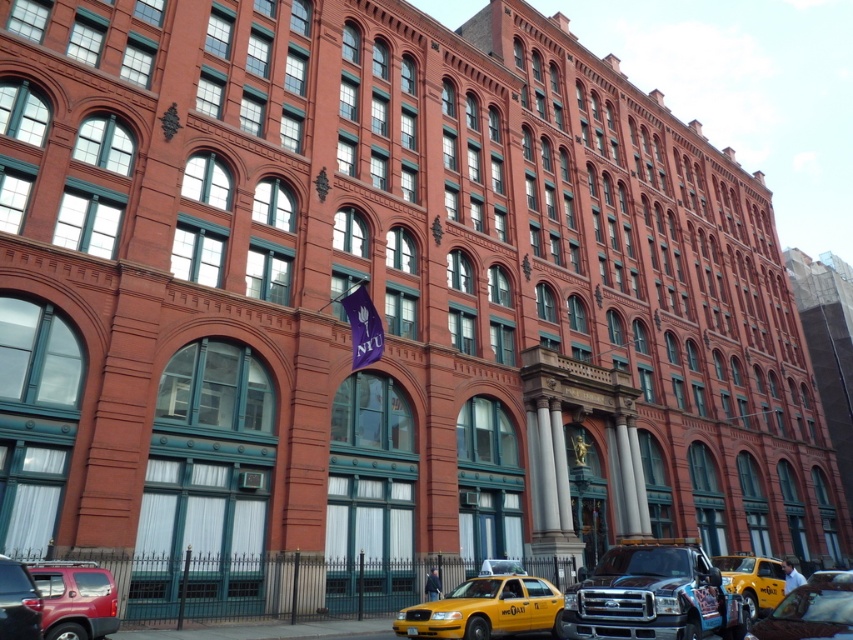
Question: Does shiny black truck at lower right have a greater width compared to matte red suv at lower left?

Choices:
 (A) yes
 (B) no

Answer: (A)

Question: Among these points, which one is farthest from the camera?

Choices:
 (A) (548, 584)
 (B) (730, 593)
 (C) (732, 563)
 (D) (6, 584)

Answer: (C)

Question: Is yellow rubber taxi cab at lower right bigger than matte black suv at lower left?

Choices:
 (A) no
 (B) yes

Answer: (B)

Question: Estimate the real-world distances between objects in this image. Which object is farther from the shiny black truck at lower right?

Choices:
 (A) yellow matte taxi at lower center
 (B) yellow rubber taxi cab at lower right

Answer: (A)

Question: Which point is closer to the camera?

Choices:
 (A) yellow matte taxi at lower center
 (B) matte black suv at lower left
 (C) yellow rubber taxi cab at lower right

Answer: (C)

Question: Is shiny black truck at lower right above yellow matte taxi at lower center?

Choices:
 (A) no
 (B) yes

Answer: (A)